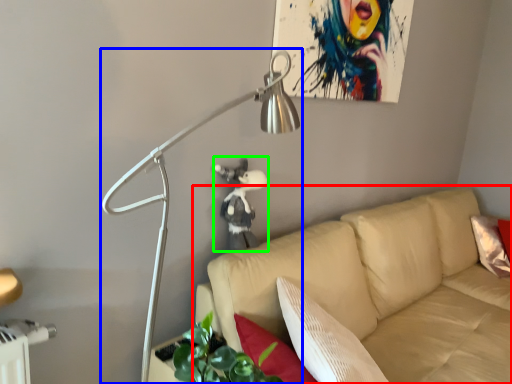
Question: Which object is positioned farthest from studio couch (highlighted by a red box)? Select from lamp (highlighted by a blue box) and person (highlighted by a green box).

Choices:
 (A) lamp
 (B) person

Answer: (A)